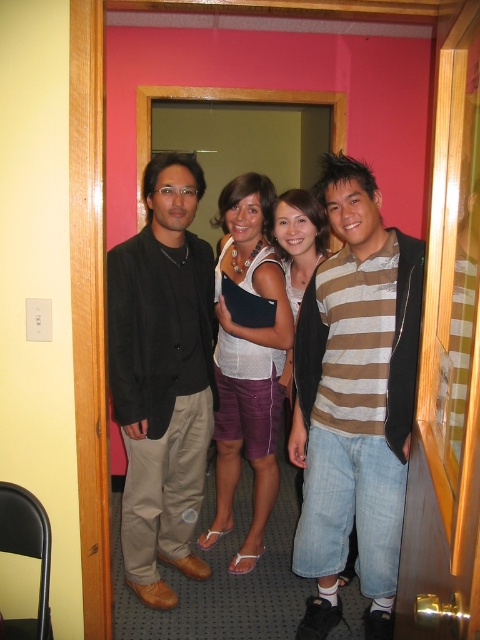
Does brown striped shirt at center appear over matte black blazer at left?

Incorrect, brown striped shirt at center is not positioned above matte black blazer at left.

Which is behind, point (316, 301) or point (149, 417)?

The point (149, 417) is behind.

You are a GUI agent. You are given a task and a screenshot of the screen. Output one action in this format:
    pyautogui.click(x=<x>, y=<y>)
    Task: Click on the brown striped shirt at center
    
    Given the screenshot: What is the action you would take?
    pyautogui.click(x=355, y=401)

Can you confirm if matte black blazer at left is bigger than matte white tank top at center?

Incorrect, matte black blazer at left is not larger than matte white tank top at center.

Is matte black blazer at left above matte white tank top at center?

Incorrect, matte black blazer at left is not positioned above matte white tank top at center.

Does point (193, 186) come closer to viewer compared to point (219, 349)?

Yes.

The height and width of the screenshot is (640, 480). I want to click on matte black blazer at left, so click(163, 376).

Is brown striped shirt at center to the right of matte white tank top at center from the viewer's perspective?

Correct, you'll find brown striped shirt at center to the right of matte white tank top at center.

Is brown striped shirt at center wider than matte white tank top at center?

No, brown striped shirt at center is not wider than matte white tank top at center.

Between point (372, 618) and point (282, 332), which one is positioned behind?

Point (282, 332)

This screenshot has width=480, height=640. What are the coordinates of `brown striped shirt at center` in the screenshot? It's located at (355, 401).